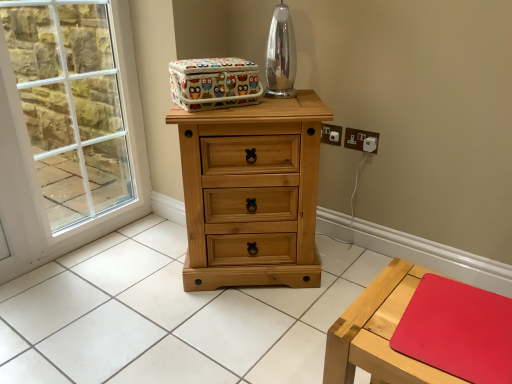
Question: Is wooden table at lower right far away from white plastic electric outlet at upper right?

Choices:
 (A) no
 (B) yes

Answer: (A)

Question: Is wooden table at lower right thinner than white plastic electric outlet at upper right?

Choices:
 (A) no
 (B) yes

Answer: (A)

Question: From the image's perspective, does wooden table at lower right appear lower than white plastic electric outlet at upper right?

Choices:
 (A) yes
 (B) no

Answer: (A)

Question: Does wooden table at lower right have a lesser height compared to white plastic electric outlet at upper right?

Choices:
 (A) no
 (B) yes

Answer: (A)

Question: Does wooden table at lower right have a greater width compared to white plastic electric outlet at upper right?

Choices:
 (A) yes
 (B) no

Answer: (A)

Question: In the image, is white plastic electric outlet at upper right positioned in front of or behind natural wood chest of drawers at center?

Choices:
 (A) behind
 (B) front

Answer: (A)

Question: Is white plastic electric outlet at upper right inside or outside of natural wood chest of drawers at center?

Choices:
 (A) inside
 (B) outside

Answer: (B)

Question: Considering the positions of point (354, 135) and point (279, 203), is point (354, 135) closer or farther from the camera than point (279, 203)?

Choices:
 (A) closer
 (B) farther

Answer: (B)

Question: Is white plastic electric outlet at upper right bigger or smaller than natural wood chest of drawers at center?

Choices:
 (A) small
 (B) big

Answer: (A)

Question: In terms of width, does white glass window at left look wider or thinner when compared to wooden table at lower right?

Choices:
 (A) thin
 (B) wide

Answer: (A)

Question: Would you say white glass window at left is inside or outside wooden table at lower right?

Choices:
 (A) inside
 (B) outside

Answer: (B)

Question: From the image's perspective, is white glass window at left located above or below wooden table at lower right?

Choices:
 (A) above
 (B) below

Answer: (A)

Question: Is white glass window at left bigger or smaller than wooden table at lower right?

Choices:
 (A) small
 (B) big

Answer: (B)

Question: Does point (375, 150) appear closer or farther from the camera than point (208, 102)?

Choices:
 (A) farther
 (B) closer

Answer: (A)

Question: From the image's perspective, is white plastic electric outlet at upper right above or below colorful fabric storage box at upper center?

Choices:
 (A) below
 (B) above

Answer: (A)